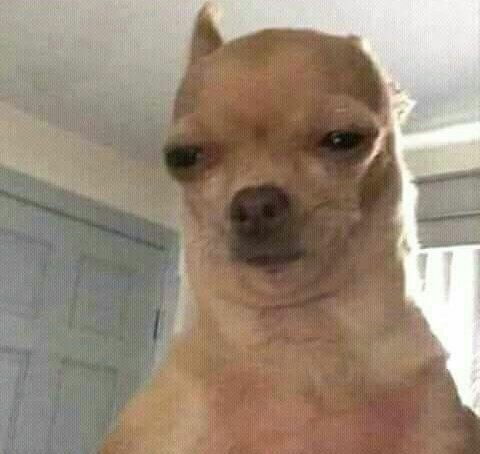
Image resolution: width=480 pixels, height=454 pixels. Identify the location of door frame. (88, 211), (172, 316).